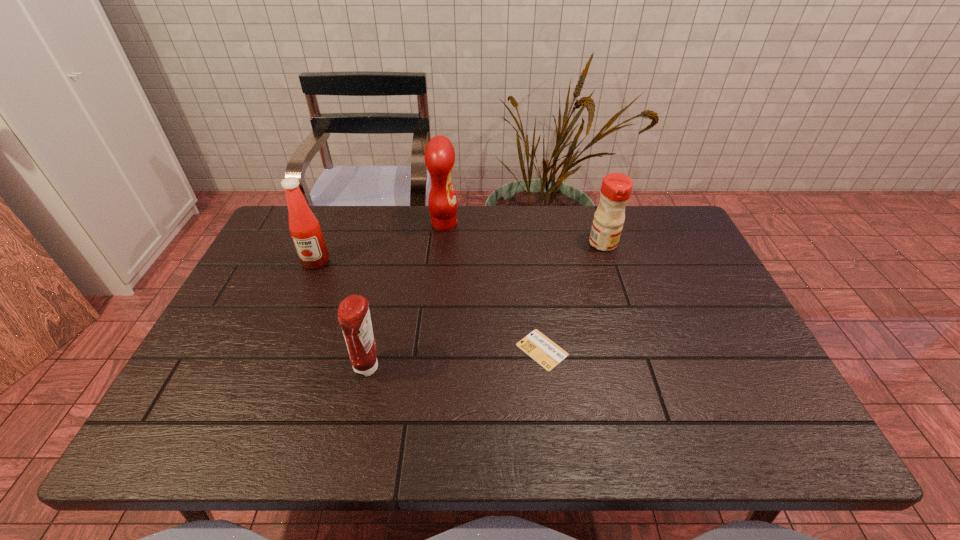
Where is `vacant space in between the leftmost object and the rightmost object`? This screenshot has width=960, height=540. vacant space in between the leftmost object and the rightmost object is located at coordinates (460, 253).

Locate an element on the screen. The image size is (960, 540). unoccupied position between the leftmost condiment and the identity card is located at coordinates (429, 306).

What are the coordinates of `vacant space that is in between the leftmost condiment and the rightmost condiment` in the screenshot? It's located at (460, 253).

You are a GUI agent. You are given a task and a screenshot of the screen. Output one action in this format:
    pyautogui.click(x=<x>, y=<y>)
    Task: Click on the vacant area that lies between the third condiment from left to right and the third nearest object
    This screenshot has height=540, width=960.
    Given the screenshot: What is the action you would take?
    pyautogui.click(x=380, y=242)

I want to click on free area in between the rightmost condiment and the third condiment from right to left, so click(486, 306).

Where is `empty space between the nearest condiment and the second condiment from right to left`? This screenshot has width=960, height=540. empty space between the nearest condiment and the second condiment from right to left is located at coordinates (406, 296).

Identify the location of object that is the second closest one to the nearest condiment. The width and height of the screenshot is (960, 540). (305, 230).

Select which object is the third closest to the fourth object from right to left. Please provide its 2D coordinates. Your answer should be formatted as a tuple, i.e. [(x, y)], where the tuple contains the x and y coordinates of a point satisfying the conditions above.

[(439, 155)]

The width and height of the screenshot is (960, 540). I want to click on condiment that can be found as the closest to the third object from right to left, so click(305, 230).

Select which condiment appears as the second closest to the rightmost object. Please provide its 2D coordinates. Your answer should be formatted as a tuple, i.e. [(x, y)], where the tuple contains the x and y coordinates of a point satisfying the conditions above.

[(353, 313)]